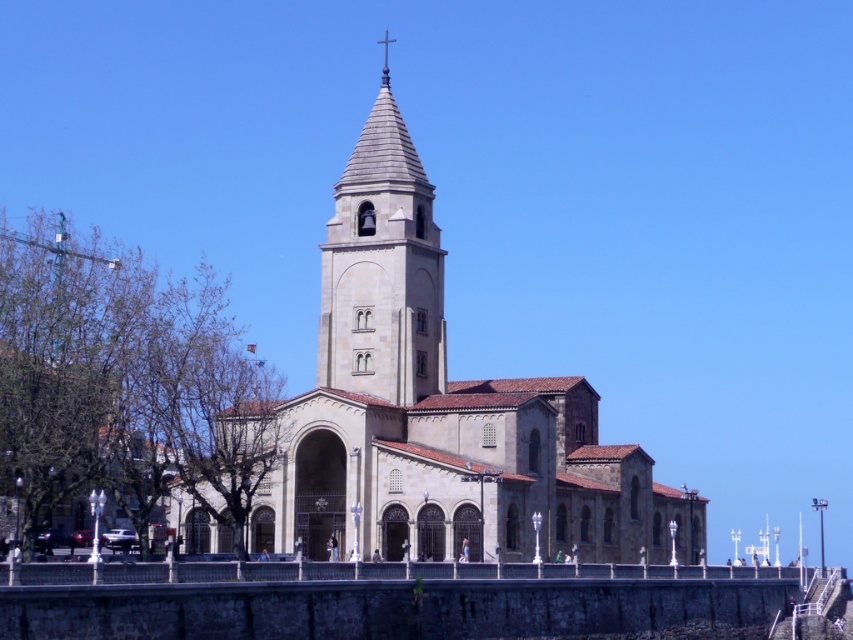
Find the location of a particular element. stone church at center is located at coordinates (440, 412).

Where is `stone church at center`? The height and width of the screenshot is (640, 853). stone church at center is located at coordinates tap(440, 412).